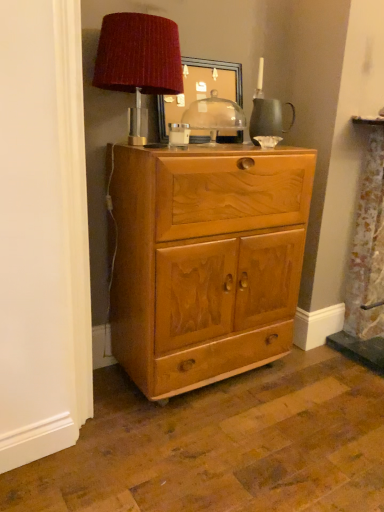
Question: Is wooden picture frame at upper center taller or shorter than velvet red lampshade at upper center?

Choices:
 (A) tall
 (B) short

Answer: (B)

Question: Looking at the image, does wooden picture frame at upper center seem bigger or smaller compared to velvet red lampshade at upper center?

Choices:
 (A) big
 (B) small

Answer: (B)

Question: Estimate the real-world distances between objects in this image. Which object is farther from the light brown wood cabinet at center?

Choices:
 (A) transparent glass dome at center
 (B) velvet red lampshade at upper center
 (C) wooden picture frame at upper center

Answer: (C)

Question: Which object is the farthest from the velvet red lampshade at upper center?

Choices:
 (A) wooden picture frame at upper center
 (B) transparent glass dome at center
 (C) light brown wood cabinet at center

Answer: (C)